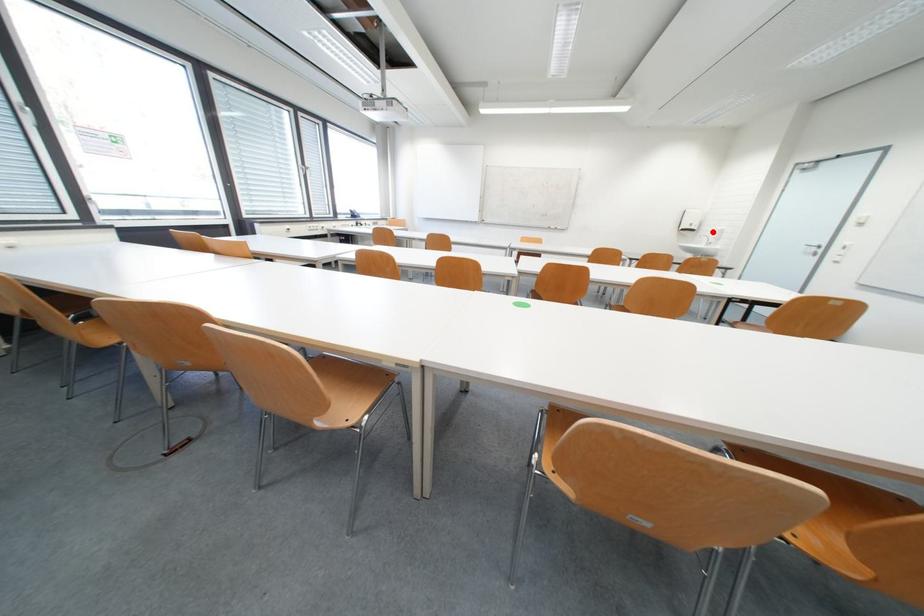
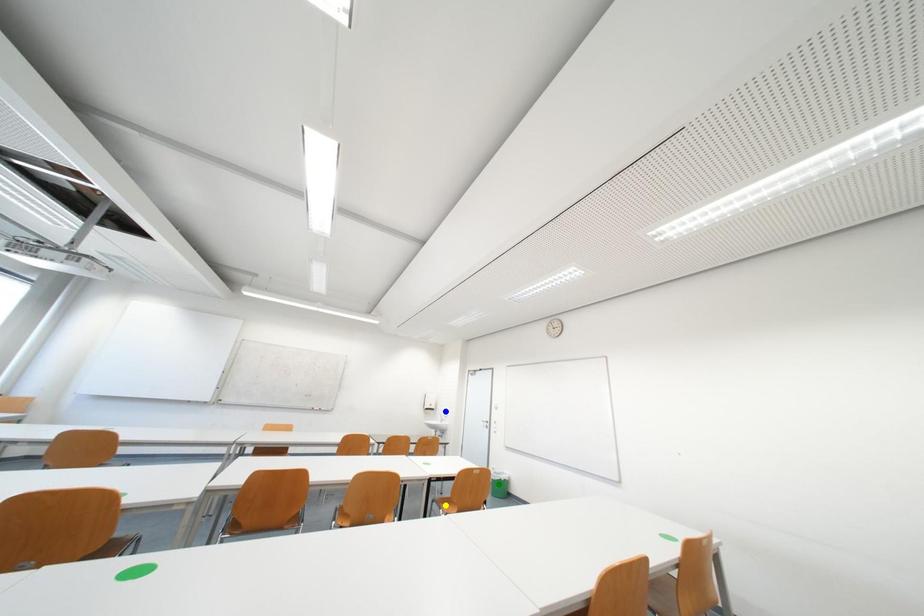
Question: I am providing you with two images of the same scene from different viewpoints. A red point is marked on the first image. You are given multiple points on the second image. Which point in image 2 is actually the same real-world point as the red point in image 1?

Choices:
 (A) green point
 (B) yellow point
 (C) blue point

Answer: (C)